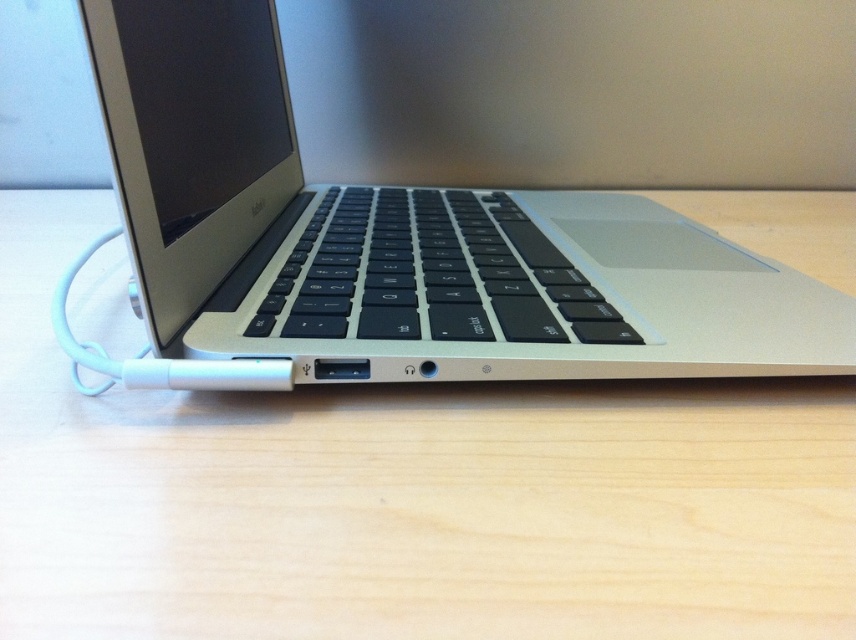
Question: Which object appears closest to the camera in this image?

Choices:
 (A) silver metallic laptop at center
 (B) light wood table at center

Answer: (B)

Question: Which object is closer to the camera taking this photo?

Choices:
 (A) silver metallic laptop at center
 (B) light wood table at center

Answer: (B)

Question: Does light wood table at center appear under silver metallic laptop at center?

Choices:
 (A) yes
 (B) no

Answer: (A)

Question: Which object is farther from the camera taking this photo?

Choices:
 (A) light wood table at center
 (B) silver metallic laptop at center

Answer: (B)

Question: Is light wood table at center further to the viewer compared to silver metallic laptop at center?

Choices:
 (A) yes
 (B) no

Answer: (B)

Question: Is light wood table at center positioned before silver metallic laptop at center?

Choices:
 (A) no
 (B) yes

Answer: (B)